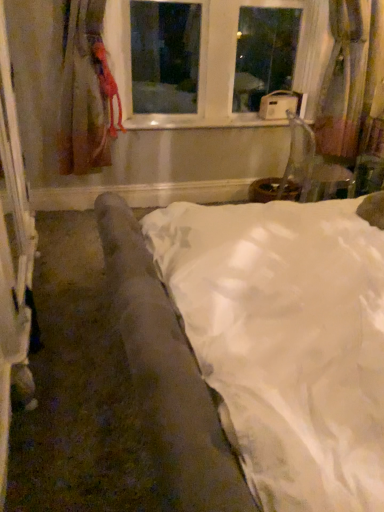
Question: Can you confirm if white plastic window at upper center is taller than white satin bed at center?

Choices:
 (A) no
 (B) yes

Answer: (B)

Question: Does white plastic window at upper center lie behind white satin bed at center?

Choices:
 (A) no
 (B) yes

Answer: (B)

Question: Considering the relative sizes of white plastic window at upper center and white satin bed at center in the image provided, is white plastic window at upper center thinner than white satin bed at center?

Choices:
 (A) no
 (B) yes

Answer: (B)

Question: From a real-world perspective, is white plastic window at upper center located higher than white satin bed at center?

Choices:
 (A) no
 (B) yes

Answer: (B)

Question: Does white plastic window at upper center turn towards white satin bed at center?

Choices:
 (A) yes
 (B) no

Answer: (B)

Question: Considering the relative positions of white plastic window at upper center and white satin bed at center in the image provided, is white plastic window at upper center in front of white satin bed at center?

Choices:
 (A) no
 (B) yes

Answer: (A)

Question: Does velvet brown armchair at lower right have a lesser height compared to velvet-like pink curtain at right, positioned as the 1th curtain in right-to-left order?

Choices:
 (A) no
 (B) yes

Answer: (B)

Question: Can you confirm if velvet brown armchair at lower right is positioned to the left of velvet-like pink curtain at right, positioned as the 1th curtain in right-to-left order?

Choices:
 (A) no
 (B) yes

Answer: (B)

Question: Would you say velvet-like pink curtain at right, positioned as the 1th curtain in right-to-left order, is part of velvet brown armchair at lower right's contents?

Choices:
 (A) yes
 (B) no

Answer: (B)

Question: Is velvet brown armchair at lower right further to camera compared to velvet-like pink curtain at right, which ranks as the second curtain in left-to-right order?

Choices:
 (A) no
 (B) yes

Answer: (A)

Question: Considering the relative positions of velvet brown armchair at lower right and velvet-like pink curtain at right, which ranks as the second curtain in left-to-right order, in the image provided, is velvet brown armchair at lower right to the right of velvet-like pink curtain at right, which ranks as the second curtain in left-to-right order, from the viewer's perspective?

Choices:
 (A) no
 (B) yes

Answer: (A)

Question: From the image's perspective, is velvet brown armchair at lower right beneath velvet-like pink curtain at right, which ranks as the second curtain in left-to-right order?

Choices:
 (A) yes
 (B) no

Answer: (A)

Question: Is matte red curtain at left, acting as the 1th curtain starting from the left, far away from white glossy window sill at center?

Choices:
 (A) yes
 (B) no

Answer: (B)